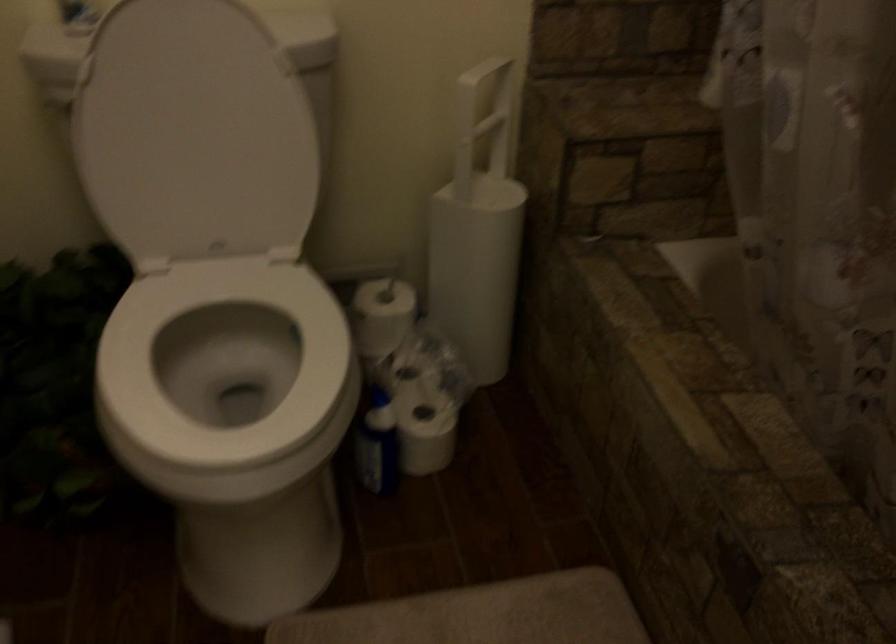
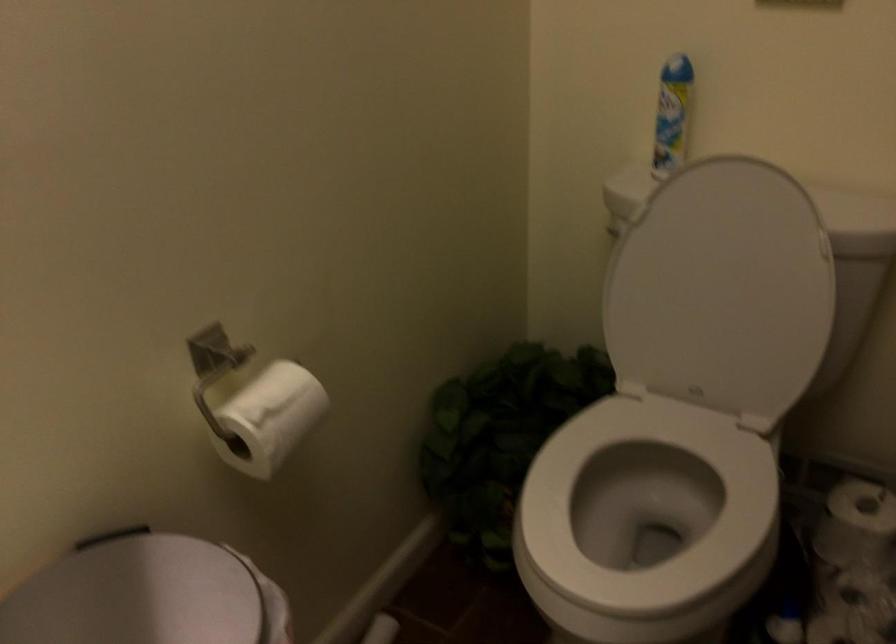
Question: The first image is from the beginning of the video and the second image is from the end. How did the camera likely rotate when shooting the video?

Choices:
 (A) Left
 (B) Right
 (C) Up
 (D) Down

Answer: (A)